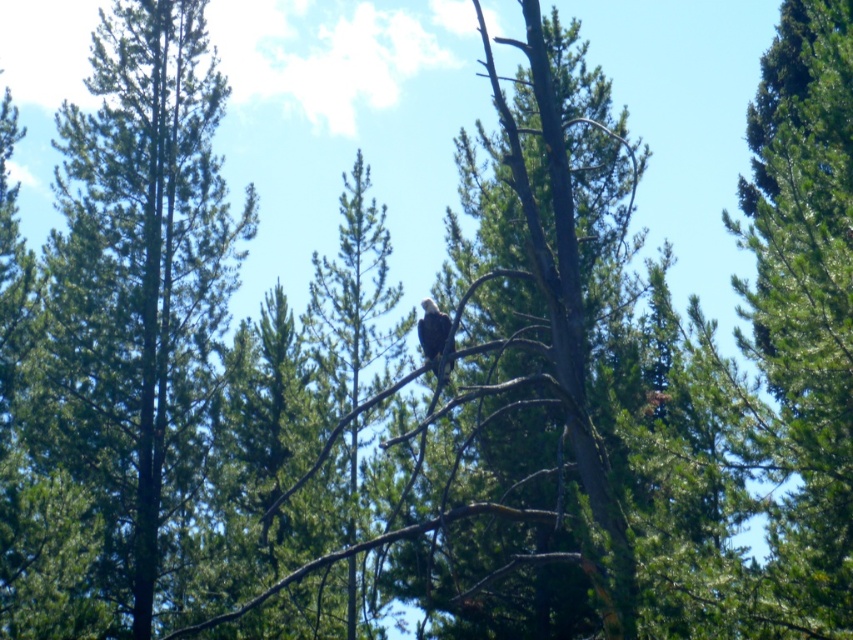
Question: Which object is farther from the camera taking this photo?

Choices:
 (A) green textured tree at left
 (B) white feathered eagle at center

Answer: (A)

Question: Does green textured tree at left appear under white feathered eagle at center?

Choices:
 (A) no
 (B) yes

Answer: (A)

Question: Is green textured tree at left wider than white feathered eagle at center?

Choices:
 (A) no
 (B) yes

Answer: (B)

Question: Can you confirm if green textured tree at left is positioned above white feathered eagle at center?

Choices:
 (A) no
 (B) yes

Answer: (B)